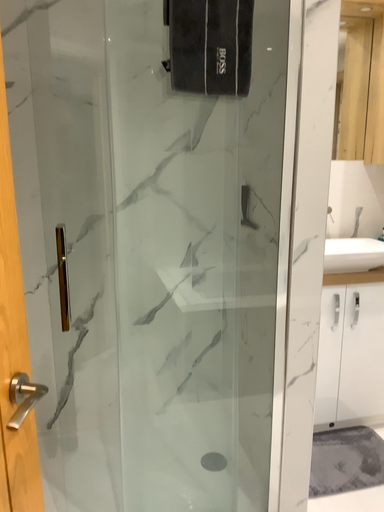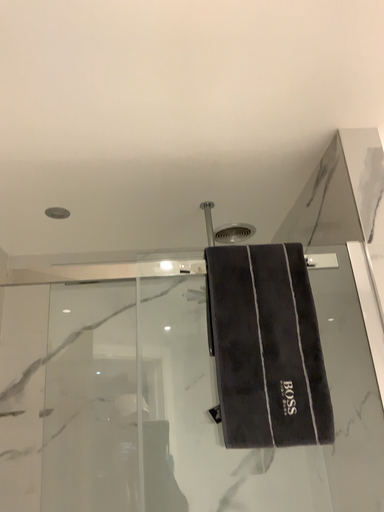
Question: Which way did the camera rotate in the video?

Choices:
 (A) rotated left
 (B) rotated right

Answer: (A)